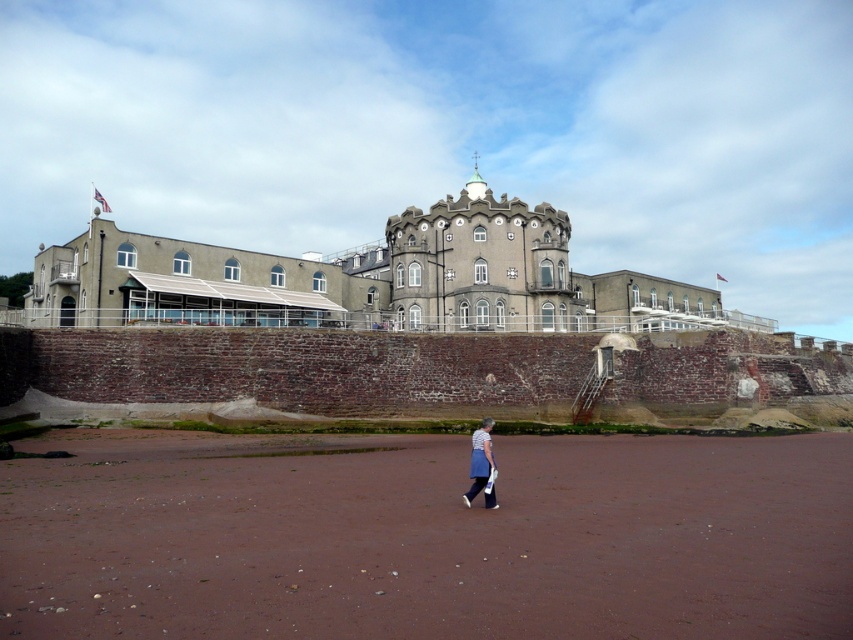
Who is taller, gray stone castle at center or blue denim skirt at lower center?

Standing taller between the two is gray stone castle at center.

Find the location of `gray stone castle at center`. gray stone castle at center is located at coordinates (370, 280).

At what (x,y) coordinates should I click in order to perform the action: click on gray stone castle at center. Please return your answer as a coordinate pair (x, y). Looking at the image, I should click on (370, 280).